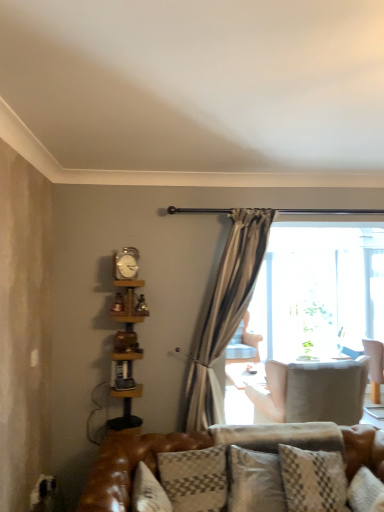
Question: Considering the relative sizes of metallic silver clock at upper center and wooden bookshelf at left in the image provided, is metallic silver clock at upper center wider than wooden bookshelf at left?

Choices:
 (A) no
 (B) yes

Answer: (A)

Question: Considering the relative positions of metallic silver clock at upper center and wooden bookshelf at left in the image provided, is metallic silver clock at upper center to the left of wooden bookshelf at left from the viewer's perspective?

Choices:
 (A) no
 (B) yes

Answer: (B)

Question: Does metallic silver clock at upper center have a smaller size compared to wooden bookshelf at left?

Choices:
 (A) no
 (B) yes

Answer: (B)

Question: Considering the relative sizes of metallic silver clock at upper center and wooden bookshelf at left in the image provided, is metallic silver clock at upper center thinner than wooden bookshelf at left?

Choices:
 (A) no
 (B) yes

Answer: (B)

Question: Is metallic silver clock at upper center to the right of wooden bookshelf at left from the viewer's perspective?

Choices:
 (A) no
 (B) yes

Answer: (A)

Question: In the image, is plush gray pillow at center, the first pillow when ordered from back to front, on the left side or the right side of light beige fabric chair at center, the 2th chair viewed from the right?

Choices:
 (A) left
 (B) right

Answer: (A)

Question: From the image's perspective, is plush gray pillow at center, the first pillow when ordered from back to front, positioned above or below light beige fabric chair at center, the 2th chair viewed from the right?

Choices:
 (A) below
 (B) above

Answer: (B)

Question: Looking at their shapes, would you say plush gray pillow at center, arranged as the second pillow when viewed from the front, is wider or thinner than light beige fabric chair at center, which is the 2th chair from left to right?

Choices:
 (A) thin
 (B) wide

Answer: (A)

Question: Considering their positions, is plush gray pillow at center, arranged as the second pillow when viewed from the front, located in front of or behind light beige fabric chair at center, the first chair in the front-to-back sequence?

Choices:
 (A) front
 (B) behind

Answer: (A)

Question: From a real-world perspective, is plush gray pillow at center, the first pillow when ordered from back to front, above or below clear glass screen door at center?

Choices:
 (A) below
 (B) above

Answer: (A)

Question: In terms of width, does plush gray pillow at center, the first pillow when ordered from right to left, look wider or thinner when compared to clear glass screen door at center?

Choices:
 (A) wide
 (B) thin

Answer: (B)

Question: Is plush gray pillow at center, the first pillow when ordered from right to left, inside or outside of clear glass screen door at center?

Choices:
 (A) outside
 (B) inside

Answer: (A)

Question: From the image's perspective, is plush gray pillow at center, positioned as the second pillow in left-to-right order, located above or below clear glass screen door at center?

Choices:
 (A) above
 (B) below

Answer: (B)

Question: From the image's perspective, is clear glass screen door at center positioned above or below plush gray pillow at center, the first pillow when ordered from right to left?

Choices:
 (A) below
 (B) above

Answer: (B)

Question: Looking at their shapes, would you say clear glass screen door at center is wider or thinner than plush gray pillow at center, positioned as the second pillow in left-to-right order?

Choices:
 (A) wide
 (B) thin

Answer: (A)